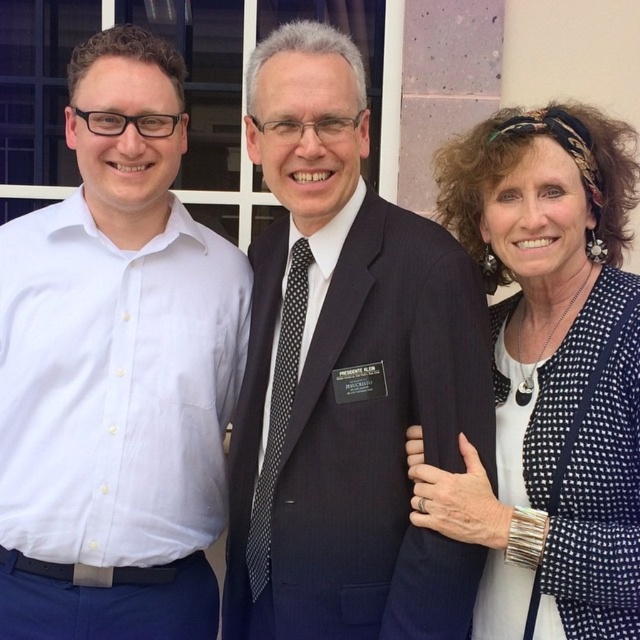
Consider the image. You are organizing a photo shoot and need to ensure that all participants are visible in the frame. Given the white cotton shirt at left and the dark blue textured suit at center, which clothing item is narrower and would require less space in the photo composition?

The white cotton shirt at left is narrower than the dark blue textured suit at center, so it requires less space in the photo composition.